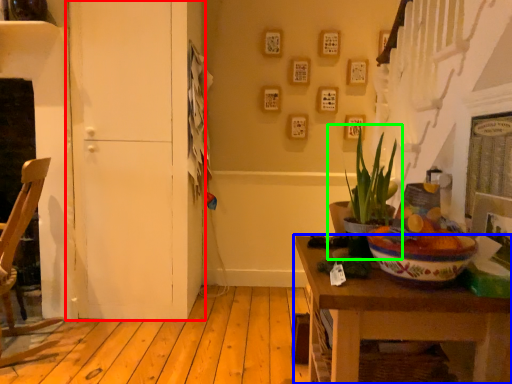
Question: Considering the real-world distances, which object is closest to door (highlighted by a red box)? table (highlighted by a blue box) or houseplant (highlighted by a green box).

Choices:
 (A) table
 (B) houseplant

Answer: (B)